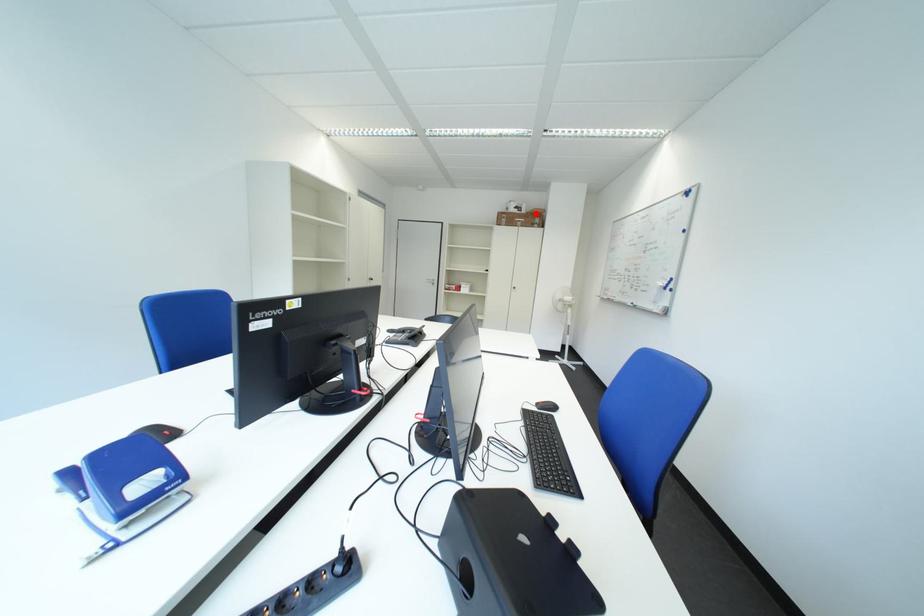
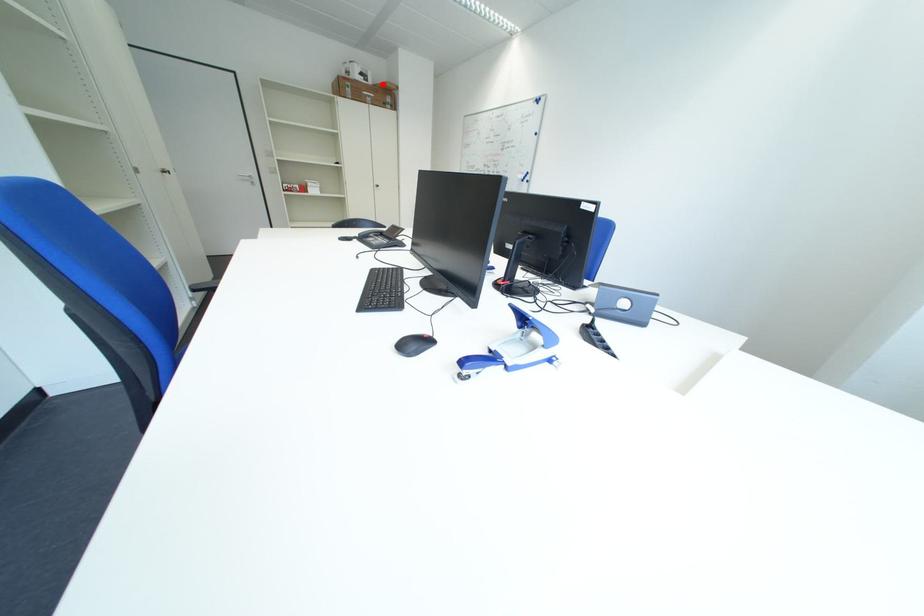
I am providing you with two images of the same scene from different viewpoints. A red point is marked on the first image and another point is marked on the second image. Do the highlighted points in image1 and image2 indicate the same real-world spot?

Yes